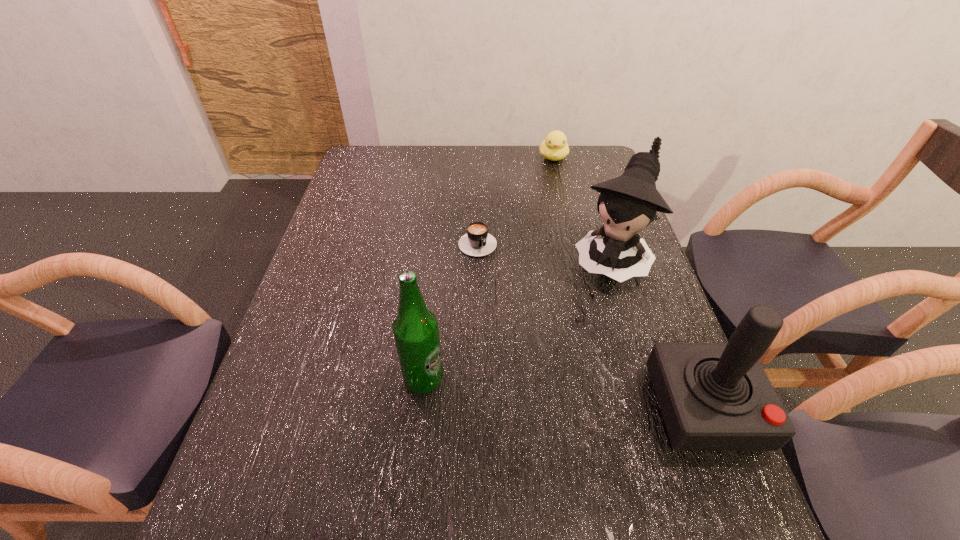
The width and height of the screenshot is (960, 540). I want to click on the leftmost object, so click(416, 331).

The image size is (960, 540). I want to click on joystick, so click(x=713, y=396).

Find the location of a particular element. This screenshot has height=540, width=960. the second shortest object is located at coordinates (554, 147).

Locate an element on the screen. The image size is (960, 540). duckling is located at coordinates (554, 147).

Image resolution: width=960 pixels, height=540 pixels. I want to click on the fourth object from right to left, so click(477, 242).

Identify the location of the shortest object. (477, 242).

Image resolution: width=960 pixels, height=540 pixels. In order to click on doll in this screenshot , I will do `click(627, 204)`.

Where is `free point located 0.150m on the label of the beer bottle`? The image size is (960, 540). free point located 0.150m on the label of the beer bottle is located at coordinates (513, 379).

You are a GUI agent. You are given a task and a screenshot of the screen. Output one action in this format:
    pyautogui.click(x=<x>, y=<y>)
    Task: Click on the free point located at the beak of the farthest object
    
    Given the screenshot: What is the action you would take?
    pyautogui.click(x=568, y=232)

Where is `vacant region located 0.330m at the beak of the farthest object`? vacant region located 0.330m at the beak of the farthest object is located at coordinates (566, 224).